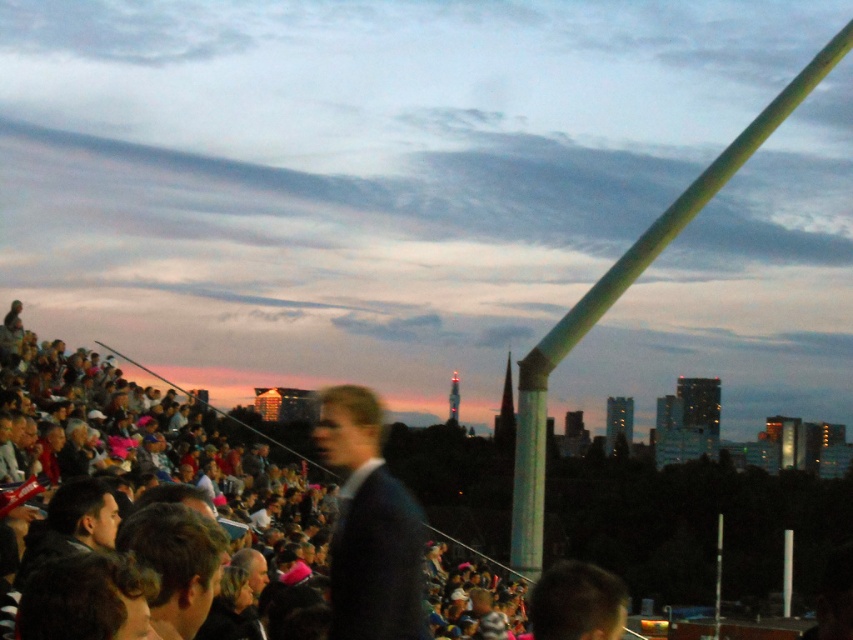
You are a photographer trying to capture a photo of the dark brown hair at center without the green glossy pole at upper right blocking the view. Can you move to the left to achieve this?

The green glossy pole at upper right is to the right of the dark brown hair at center. Moving to the left would place the photographer further away from the pole, potentially allowing the dark brown hair at center to be framed without obstruction from the pole.

You are a photographer standing at the center of the stadium. You want to take a photo of the green glossy pole at upper right. What are the coordinates of the pole in the image?

The coordinates of the green glossy pole at upper right are at point (619, 294).

You are a photographer standing in the stadium trying to capture a clear photo of the dark brown hair at center. However, the green glossy pole at upper right is blocking your view. Can you move to the left or right to avoid the pole?

The dark brown hair at center is behind the green glossy pole at upper right, so moving to the left or right might help you avoid the pole and get a clearer shot of the dark brown hair at center.